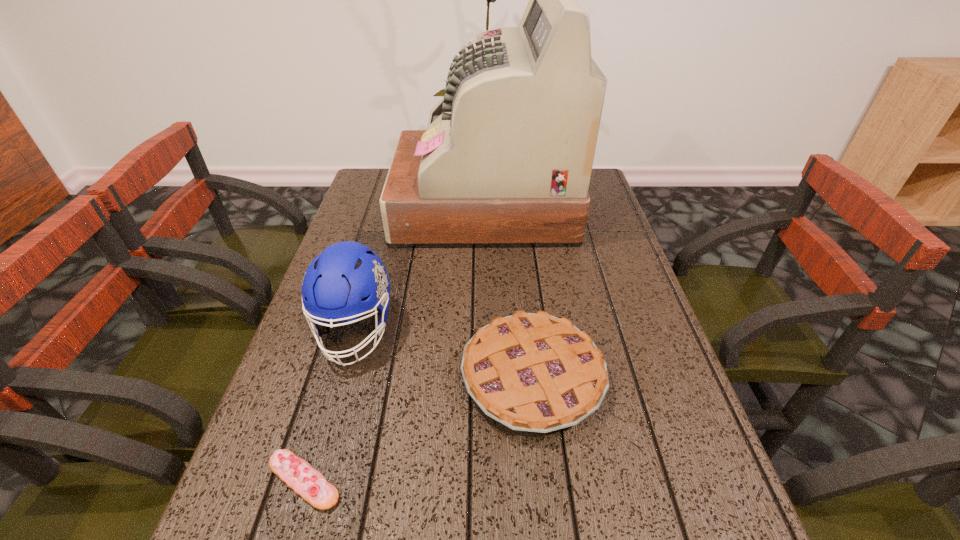
Where is `free space at the far left corner of the desktop`? The width and height of the screenshot is (960, 540). free space at the far left corner of the desktop is located at coordinates (381, 177).

Where is `vacant space that is in between the pie and the nearest object`? vacant space that is in between the pie and the nearest object is located at coordinates (419, 429).

In order to click on vacant space in between the tallest object and the third tallest object in this screenshot , I will do `click(508, 291)`.

The height and width of the screenshot is (540, 960). In order to click on free point between the farthest object and the shortest object in this screenshot , I will do `click(394, 342)`.

Image resolution: width=960 pixels, height=540 pixels. In order to click on blank region between the shortest object and the second tallest object in this screenshot , I will do `click(329, 405)`.

Where is `empty location between the pie and the second tallest object`? The image size is (960, 540). empty location between the pie and the second tallest object is located at coordinates point(444,354).

You are a GUI agent. You are given a task and a screenshot of the screen. Output one action in this format:
    pyautogui.click(x=<x>, y=<y>)
    Task: Click on the empty space that is in between the nearest object and the pie
    Image resolution: width=960 pixels, height=540 pixels.
    Given the screenshot: What is the action you would take?
    pyautogui.click(x=419, y=429)

Point out which object is positioned as the nearest to the third shortest object. Please provide its 2D coordinates. Your answer should be formatted as a tuple, i.e. [(x, y)], where the tuple contains the x and y coordinates of a point satisfying the conditions above.

[(537, 373)]

Locate which object is the third closest to the pie. Please provide its 2D coordinates. Your answer should be formatted as a tuple, i.e. [(x, y)], where the tuple contains the x and y coordinates of a point satisfying the conditions above.

[(506, 160)]

The width and height of the screenshot is (960, 540). In order to click on vacant space that satisfies the following two spatial constraints: 1. on the operating side of the farthest object; 2. on the left side of the third tallest object in this screenshot , I will do `click(486, 378)`.